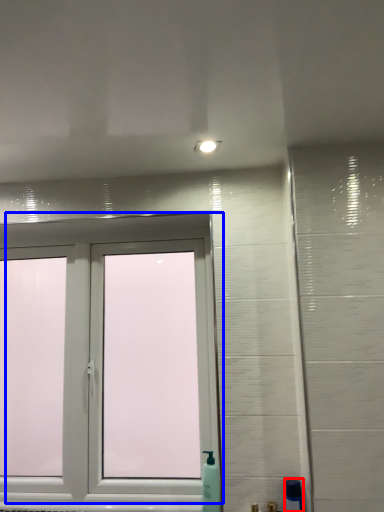
Question: Which object is closer to the camera taking this photo, soap dispenser (highlighted by a red box) or window (highlighted by a blue box)?

Choices:
 (A) soap dispenser
 (B) window

Answer: (A)